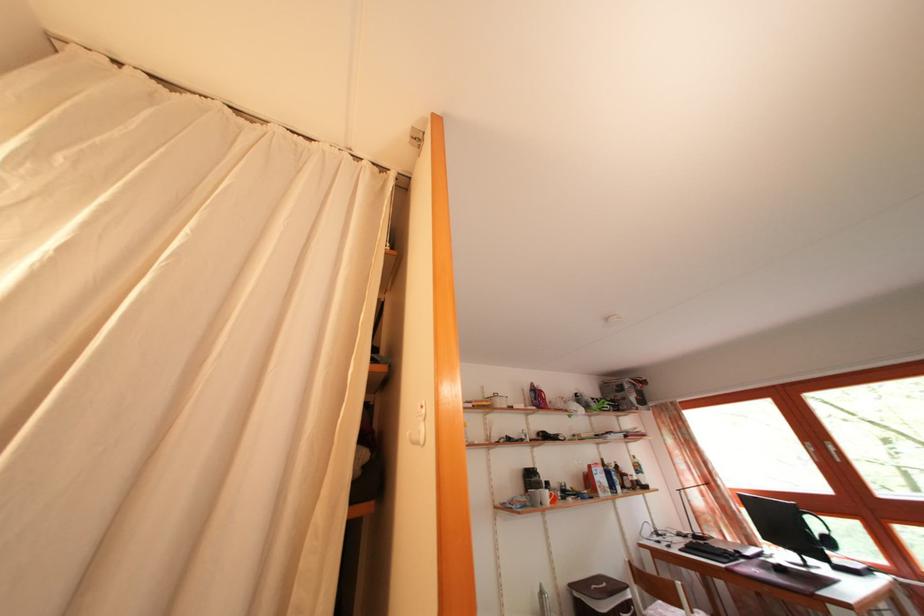
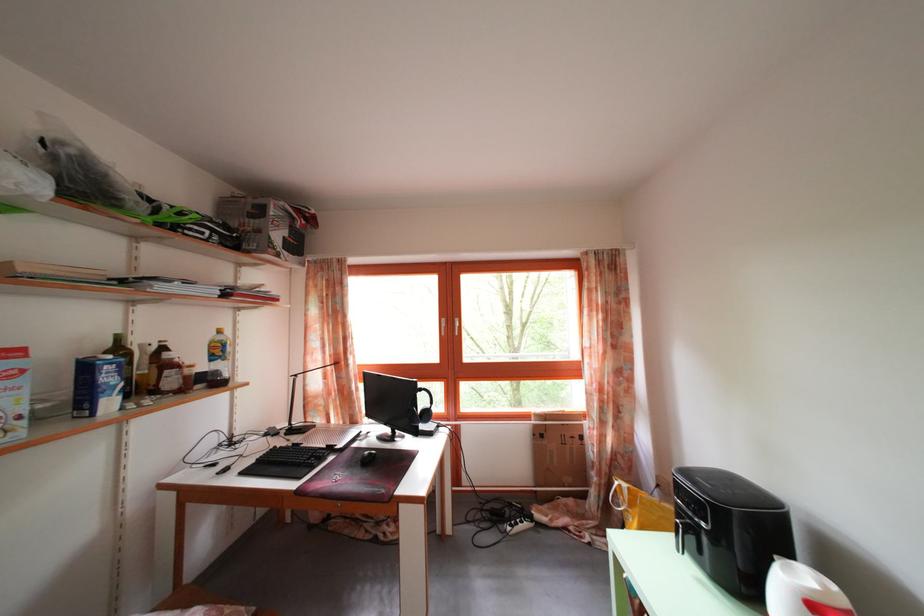
In the second image, find the point that corresponds to (626,496) in the first image.

(117, 410)